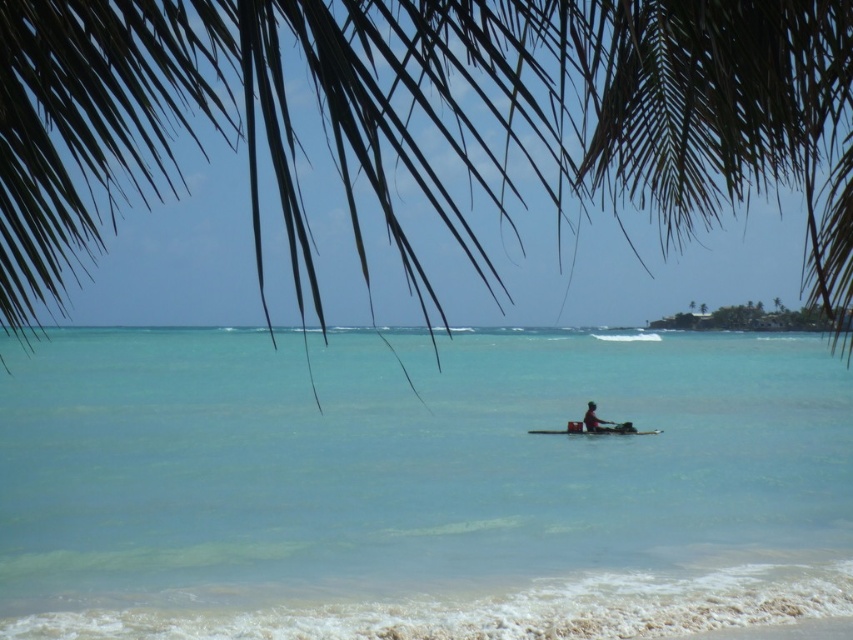
Question: Can you confirm if clear blue water at center is positioned below green leafy palm tree at upper center?

Choices:
 (A) no
 (B) yes

Answer: (B)

Question: Estimate the real-world distances between objects in this image. Which object is farther from the wooden boat at center?

Choices:
 (A) smooth wooden paddleboard at center
 (B) clear blue water at center
 (C) green leafy palm tree at upper center

Answer: (C)

Question: Does clear blue water at center have a larger size compared to smooth wooden paddleboard at center?

Choices:
 (A) yes
 (B) no

Answer: (A)

Question: Which point appears closest to the camera in this image?

Choices:
 (A) (592, 413)
 (B) (605, 433)

Answer: (B)

Question: Is wooden boat at center below smooth wooden paddleboard at center?

Choices:
 (A) no
 (B) yes

Answer: (B)

Question: Considering the real-world distances, which object is farthest from the wooden boat at center?

Choices:
 (A) green leafy palm tree at upper center
 (B) clear blue water at center

Answer: (A)